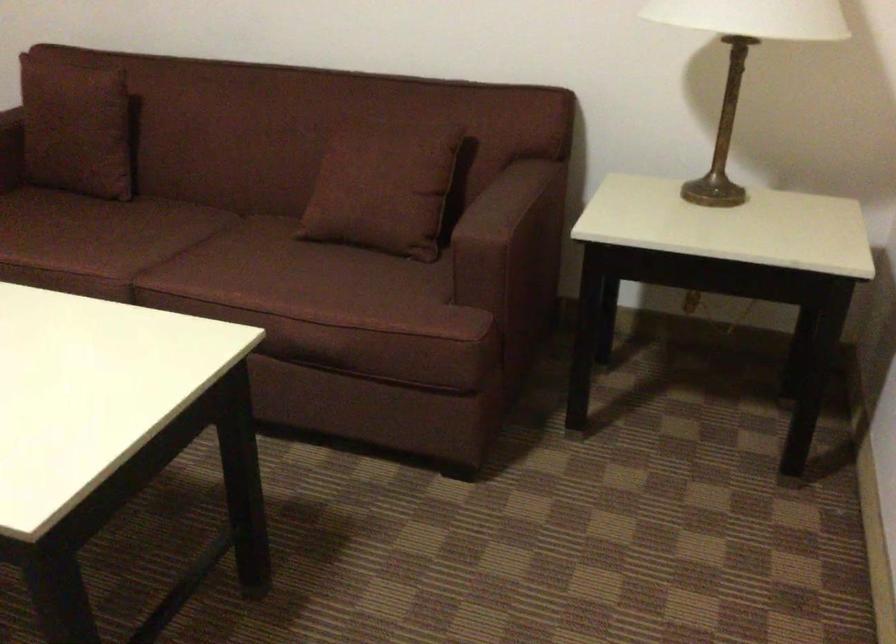
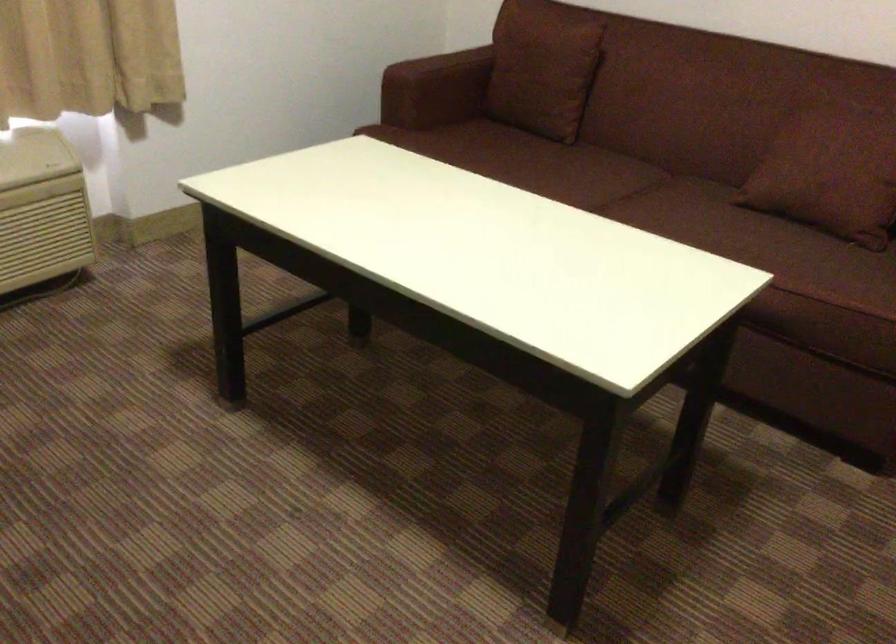
Locate, in the second image, the point that corresponds to [124,240] in the first image.

(574, 176)